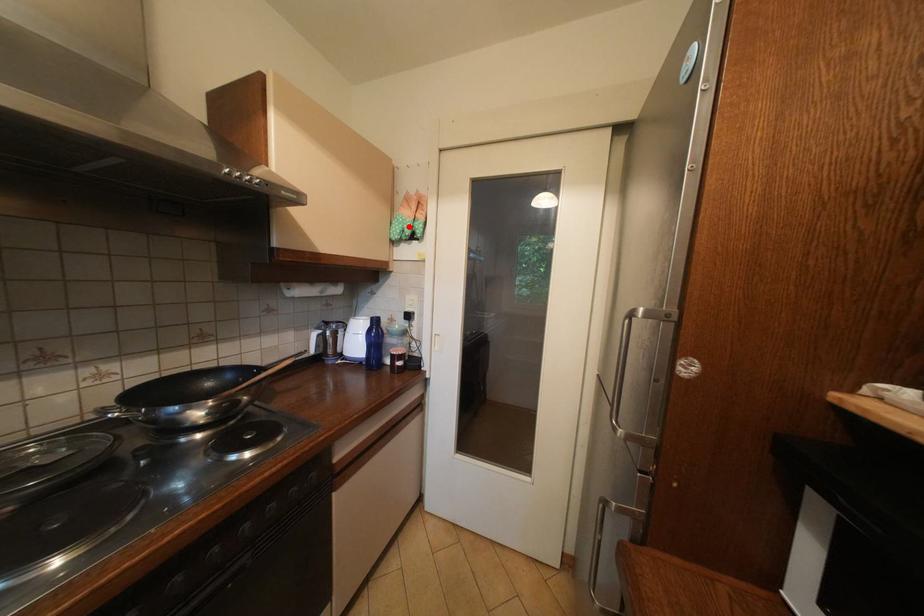
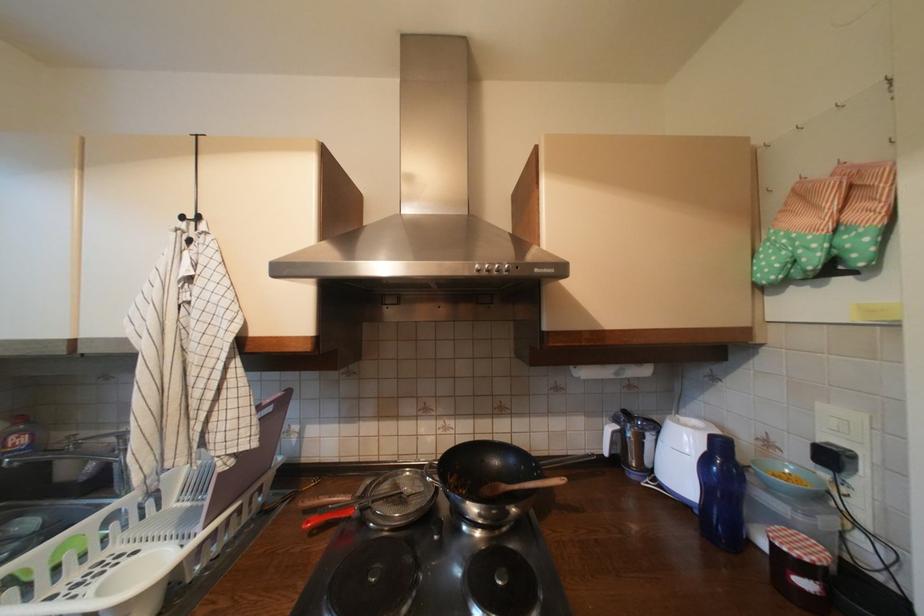
Find the pixel in the second image that matches the highlighted location in the first image.

(793, 254)